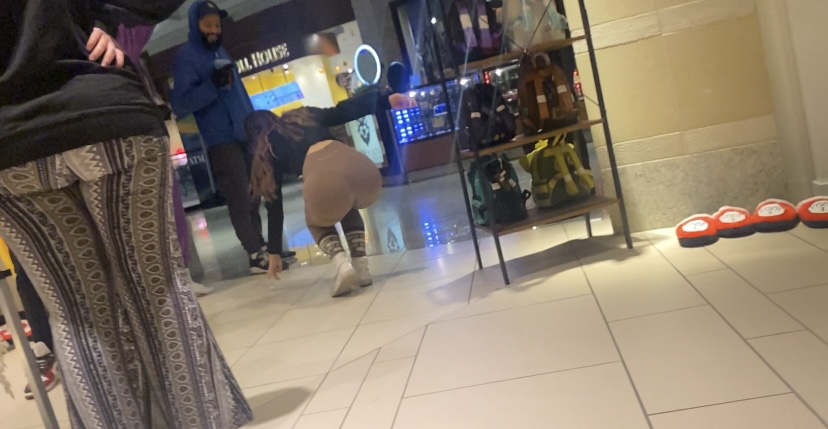
The height and width of the screenshot is (429, 828). Find the location of `clear plastic drink cup`. clear plastic drink cup is located at coordinates (219, 66).